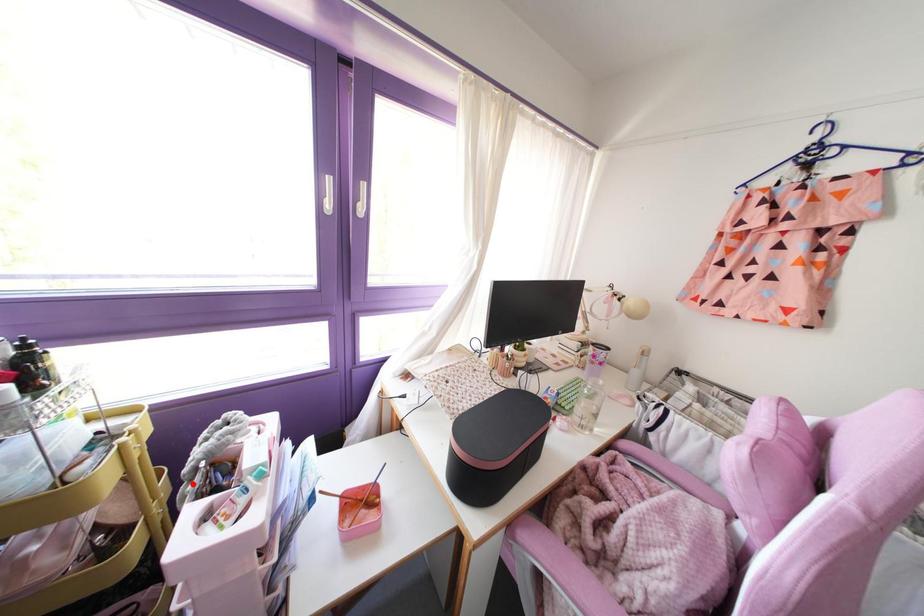
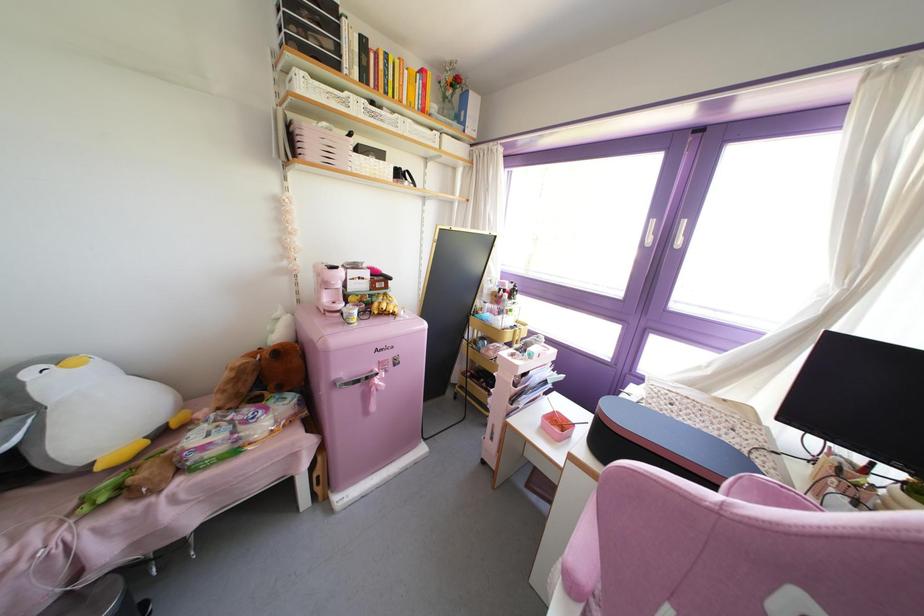
Where in the second image is the point corresponding to the highlighted location from the first image?

(516, 345)